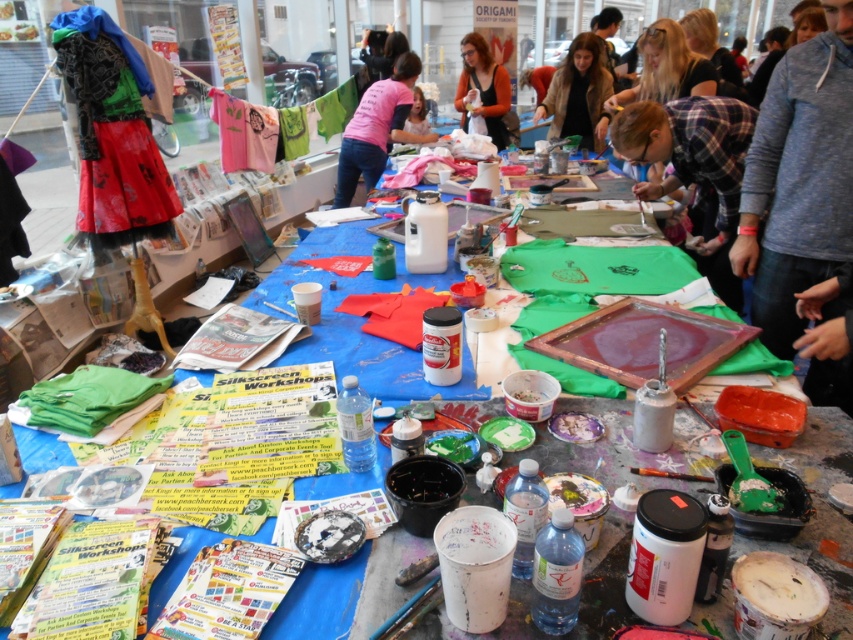
Is pink fabric at center wider than matte orange sweater at center?

Correct, the width of pink fabric at center exceeds that of matte orange sweater at center.

Is pink fabric at center smaller than matte orange sweater at center?

Incorrect, pink fabric at center is not smaller in size than matte orange sweater at center.

Where is `pink fabric at center`? pink fabric at center is located at coordinates (376, 129).

Does gray sweater at upper right appear under plaid fabric shirt at center?

Indeed, gray sweater at upper right is positioned under plaid fabric shirt at center.

Can you confirm if gray sweater at upper right is wider than plaid fabric shirt at center?

Incorrect, gray sweater at upper right's width does not surpass plaid fabric shirt at center's.

Describe the element at coordinates (798, 180) in the screenshot. This screenshot has width=853, height=640. I see `gray sweater at upper right` at that location.

This screenshot has height=640, width=853. What are the coordinates of `gray sweater at upper right` in the screenshot? It's located at (798, 180).

Is plaid fabric shirt at center to the left of brown textured jacket at center from the viewer's perspective?

No, plaid fabric shirt at center is not to the left of brown textured jacket at center.

Where is `plaid fabric shirt at center`? The width and height of the screenshot is (853, 640). plaid fabric shirt at center is located at coordinates (694, 170).